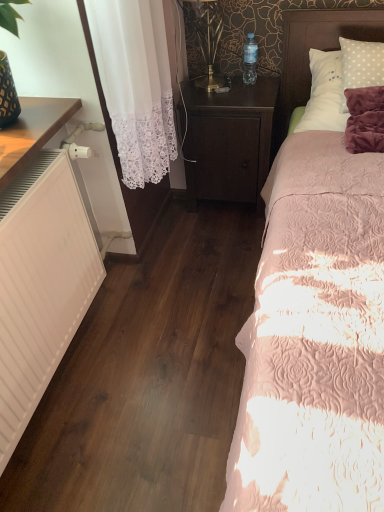
Question: Relative to white polka dot pillow at upper right, is transparent plastic bottle at upper center in front or behind?

Choices:
 (A) front
 (B) behind

Answer: (B)

Question: From the image's perspective, is transparent plastic bottle at upper center positioned above or below white polka dot pillow at upper right?

Choices:
 (A) below
 (B) above

Answer: (B)

Question: Which of these objects is positioned farthest from the pink quilted bed at right?

Choices:
 (A) white polka dot pillow at upper right
 (B) metallic gold table lamp at upper center
 (C) white matte heater at left
 (D) transparent plastic bottle at upper center
 (E) dark wood nightstand at center

Answer: (D)

Question: Estimate the real-world distances between objects in this image. Which object is closer to the white polka dot pillow at upper right?

Choices:
 (A) white matte heater at left
 (B) pink quilted bed at right
 (C) transparent plastic bottle at upper center
 (D) metallic gold table lamp at upper center
 (E) dark wood nightstand at center

Answer: (C)